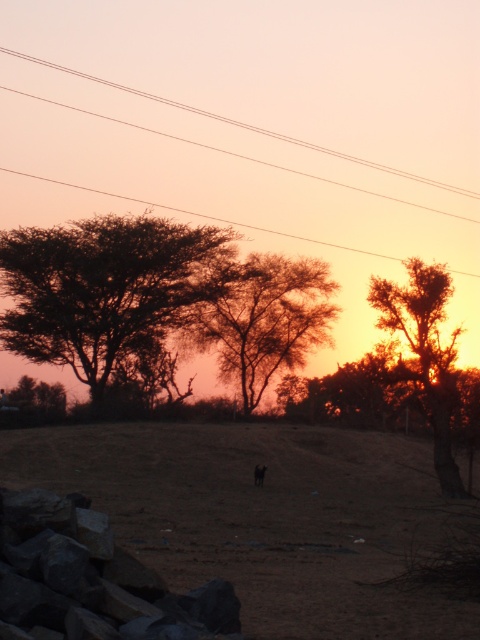
Question: Does brown dirt field at center appear on the right side of brown textured tree at right?

Choices:
 (A) yes
 (B) no

Answer: (B)

Question: Which point is closer to the camera?

Choices:
 (A) brown textured tree at center
 (B) brown textured tree at right

Answer: (B)

Question: Can you confirm if brown dirt field at center is positioned to the right of transparent wire at upper center?

Choices:
 (A) yes
 (B) no

Answer: (A)

Question: Which point appears closest to the camera in this image?

Choices:
 (A) (220, 118)
 (B) (314, 237)

Answer: (B)

Question: Can you confirm if brown dirt field at center is positioned to the right of black fur animal at center?

Choices:
 (A) yes
 (B) no

Answer: (B)

Question: Which of the following is the farthest from the observer?

Choices:
 (A) black fur animal at center
 (B) smooth wire power lines at upper center

Answer: (B)